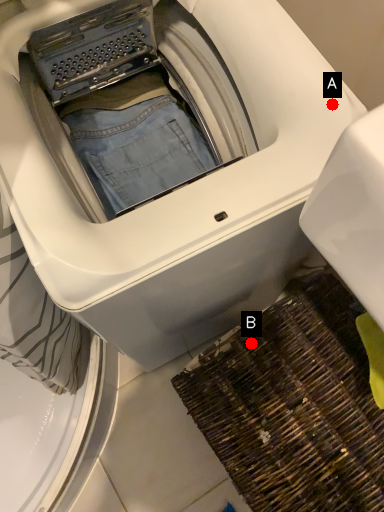
Question: Two points are circled on the image, labeled by A and B beside each circle. Which point is farther to the camera?

Choices:
 (A) A is further
 (B) B is further

Answer: (B)